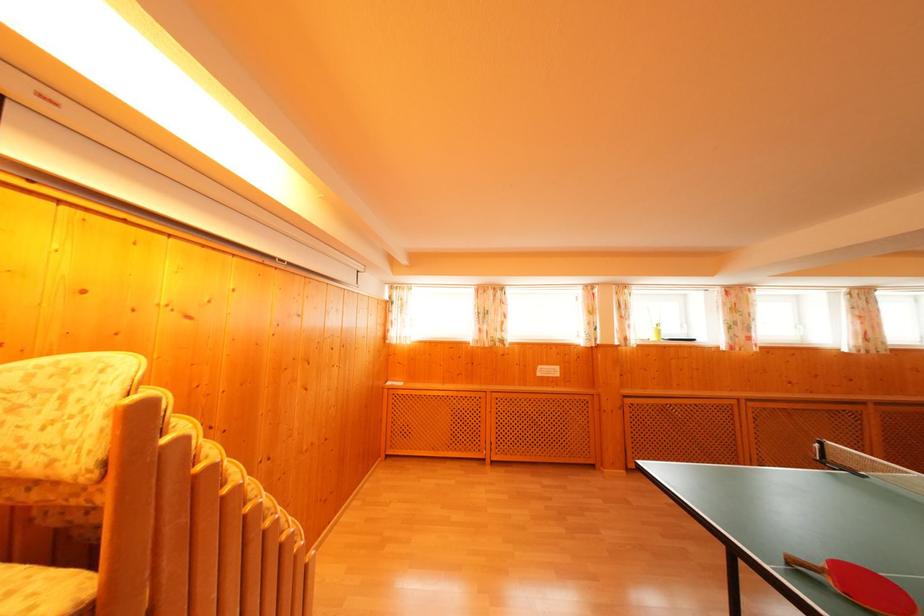
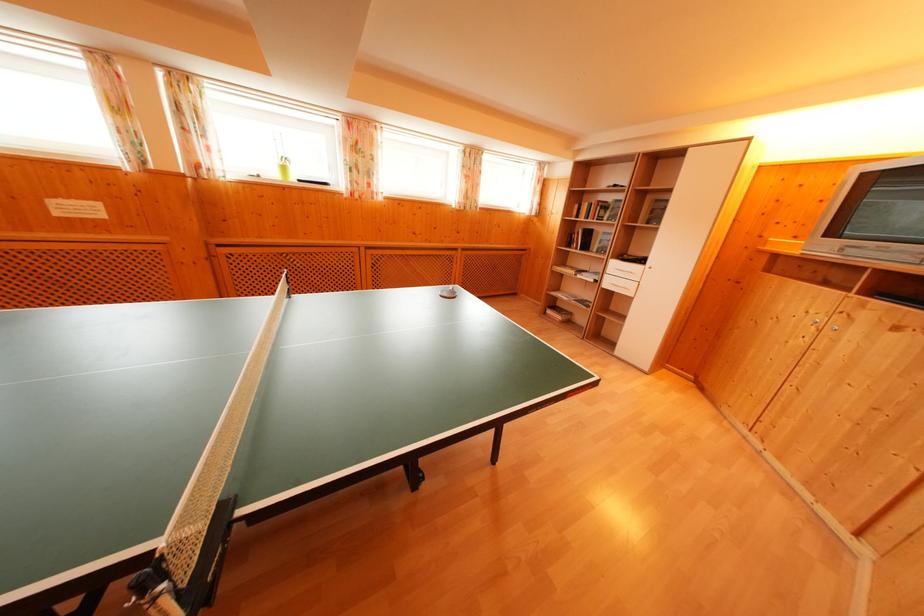
The point at (663, 337) is marked in the first image. Where is the corresponding point in the second image?

(288, 174)